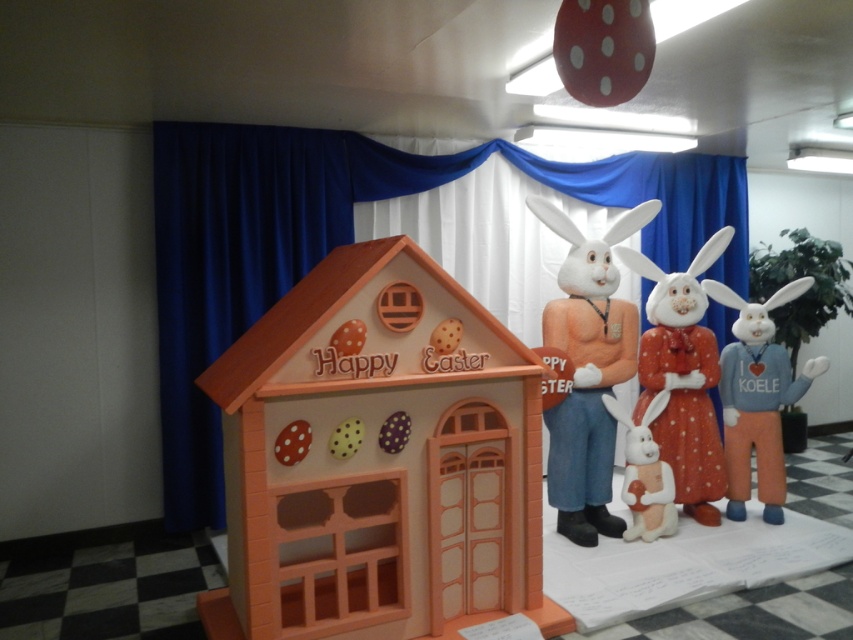
Question: Which point is farther to the camera?

Choices:
 (A) white plush rabbit at center
 (B) white matte plush at center
 (C) white matte rabbit at center
 (D) matte orange house at center

Answer: (B)

Question: Can you confirm if white plush rabbit at center is thinner than white matte plush at center?

Choices:
 (A) yes
 (B) no

Answer: (B)

Question: Which is farther from the white matte rabbit at center?

Choices:
 (A) matte orange house at center
 (B) white plush rabbit at center
 (C) white matte plush at center

Answer: (A)

Question: Is matte orange house at center bigger than white plush rabbit at center?

Choices:
 (A) yes
 (B) no

Answer: (A)

Question: Which point is farther to the camera?

Choices:
 (A) (x=422, y=492)
 (B) (x=633, y=468)

Answer: (B)

Question: Does matte orange house at center appear over white plush bunny at center?

Choices:
 (A) yes
 (B) no

Answer: (A)